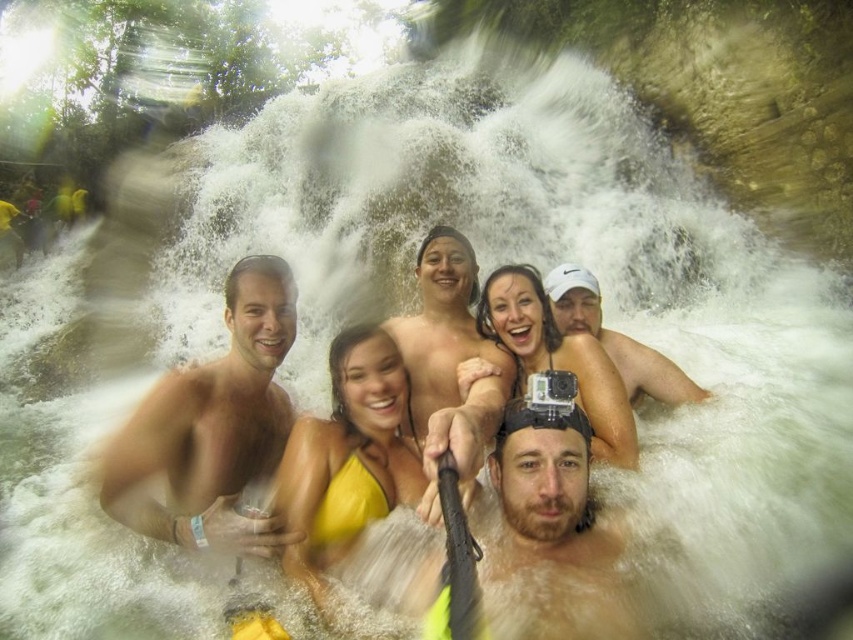
You are a photographer standing at the edge of the waterfall. You see the yellow fabric bikini at center and your camera. How far apart are they?

The yellow fabric bikini at center and the camera are 101.16 feet apart.

You are a photographer trying to capture the best shot of the two yellow swimwear items in the water scene. Since the yellow satin swimsuit at center and the yellow fabric bikini at center are both at the center, which one would you focus on to ensure it stands out more due to its size?

The yellow satin swimsuit at center has a larger size compared to the yellow fabric bikini at center, so focusing on the yellow satin swimsuit at center would make it stand out more due to its bigger size.

You are a photographer trying to capture the best shot of the two yellow swimwear items in the water scene. Since the yellow satin swimsuit at center and the yellow fabric bikini at center are both at the center, which one would appear smaller in your photo?

The yellow satin swimsuit at center has a lesser width compared to the yellow fabric bikini at center, so it would appear smaller in the photo.